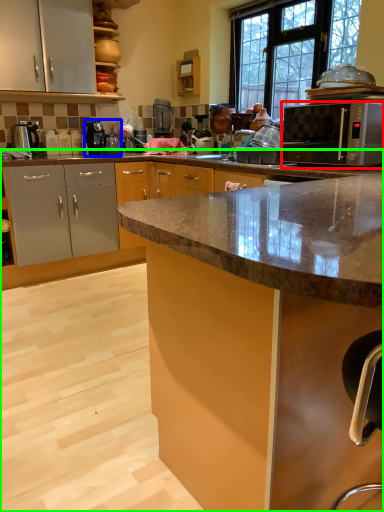
Question: Which is nearer to the microwave oven (highlighted by a red box)? coffee machine (highlighted by a blue box) or cabinetry (highlighted by a green box).

Choices:
 (A) coffee machine
 (B) cabinetry

Answer: (A)